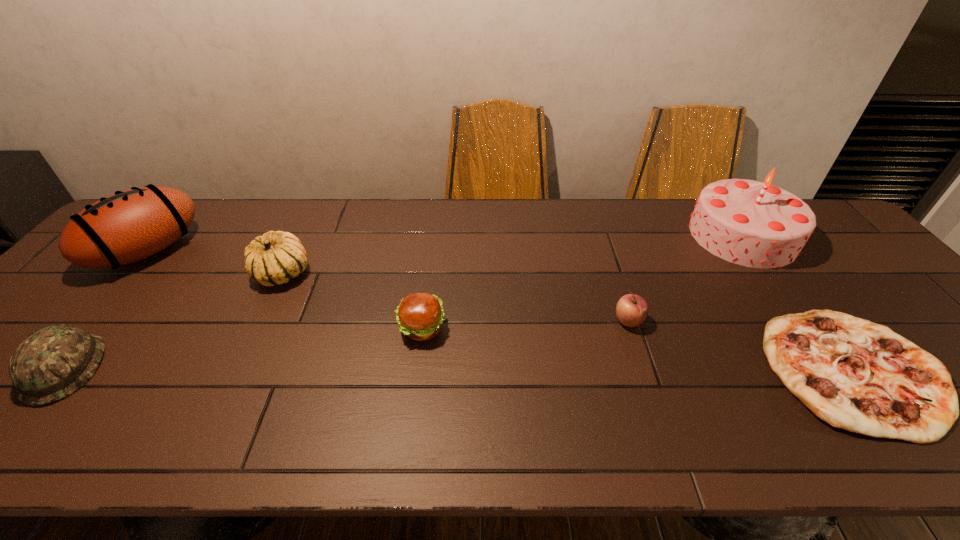
The width and height of the screenshot is (960, 540). I want to click on birthday cake, so click(x=754, y=224).

This screenshot has height=540, width=960. Find the location of `football (American)`. football (American) is located at coordinates (128, 226).

This screenshot has width=960, height=540. I want to click on gourd, so point(276,257).

This screenshot has height=540, width=960. I want to click on the third tallest object, so click(x=276, y=257).

This screenshot has width=960, height=540. In order to click on hamburger in this screenshot , I will do `click(419, 315)`.

This screenshot has height=540, width=960. What are the coordinates of `apple` in the screenshot? It's located at (631, 310).

Where is `free spot located on the front of the birthday cake`? free spot located on the front of the birthday cake is located at coordinates (787, 298).

Identify the location of free spot located on the right of the sixth shortest object. The height and width of the screenshot is (540, 960). (230, 251).

Where is `vacant space situated on the back of the fifth shortest object`? vacant space situated on the back of the fifth shortest object is located at coordinates pyautogui.click(x=298, y=242).

This screenshot has height=540, width=960. In order to click on free space located on the right of the hamburger in this screenshot , I will do `click(495, 328)`.